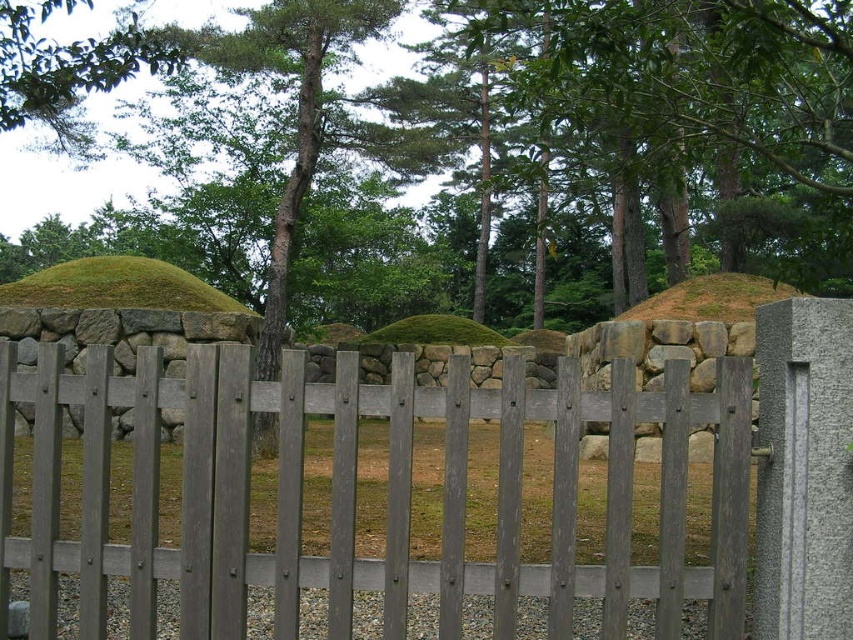
Can you confirm if green moss-covered mound at left is smaller than green mossy mound at center?

No, green moss-covered mound at left is not smaller than green mossy mound at center.

Measure the distance between green moss-covered mound at left and camera.

A distance of 52.75 feet exists between green moss-covered mound at left and camera.

Is point (80, 268) more distant than point (482, 328)?

That is False.

Image resolution: width=853 pixels, height=640 pixels. Identify the location of green moss-covered mound at left. (117, 285).

Is gray wood fence at center positioned behind green moss-covered mound at left?

No, it is not.

Which is behind, point (97, 532) or point (207, 298)?

The point (207, 298) is more distant.

Locate an element on the screen. gray wood fence at center is located at coordinates (355, 493).

Who is lower down, gray wood fence at center or green grass at center?

green grass at center

How much distance is there between gray wood fence at center and green grass at center?

gray wood fence at center is 4.07 meters away from green grass at center.

Is point (152, 390) behind point (119, 493)?

No, it is in front of (119, 493).

Find the location of a particular element. Image resolution: width=853 pixels, height=640 pixels. gray wood fence at center is located at coordinates (355, 493).